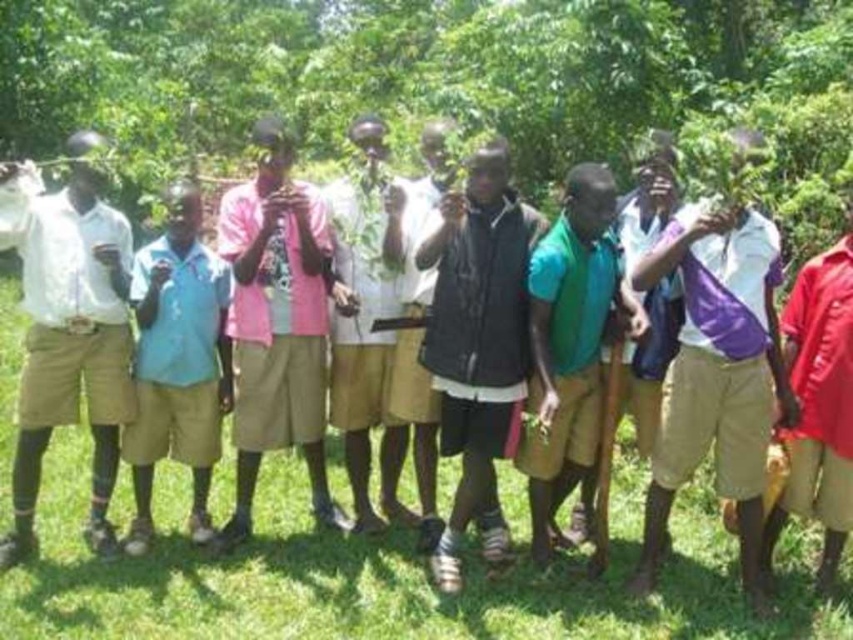
You are organizing a group photo and need to ensure everyone fits within a 1.5 meter wide frame. The black matte vest at center and the green matte shirt at center are standing side by side. Considering their widths, will both individuals fit within the frame?

The black matte vest at center is wider than the green matte shirt at center. Since the combined width of both individuals would exceed 1.5 meters, they may not fit within the frame.

You are a photographer trying to capture a clear shot of the light blue fabric shirt at left without any obstructions. Given the presence of the green leafy tree at center, what should you do to ensure the shirt is visible in your photo?

The green leafy tree at center is positioned over the light blue fabric shirt at left, so you should adjust your angle or move slightly to the right to avoid the tree blocking the view of the shirt.